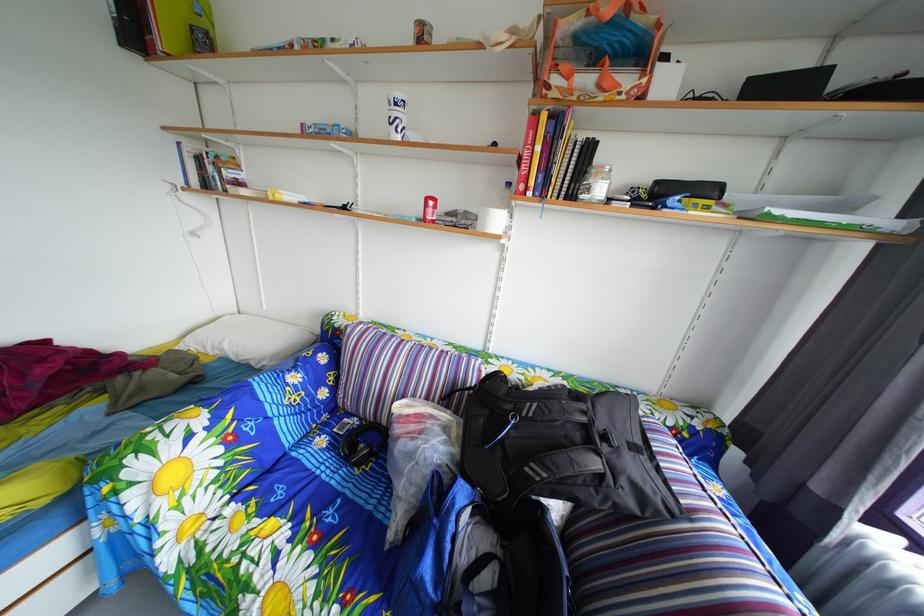
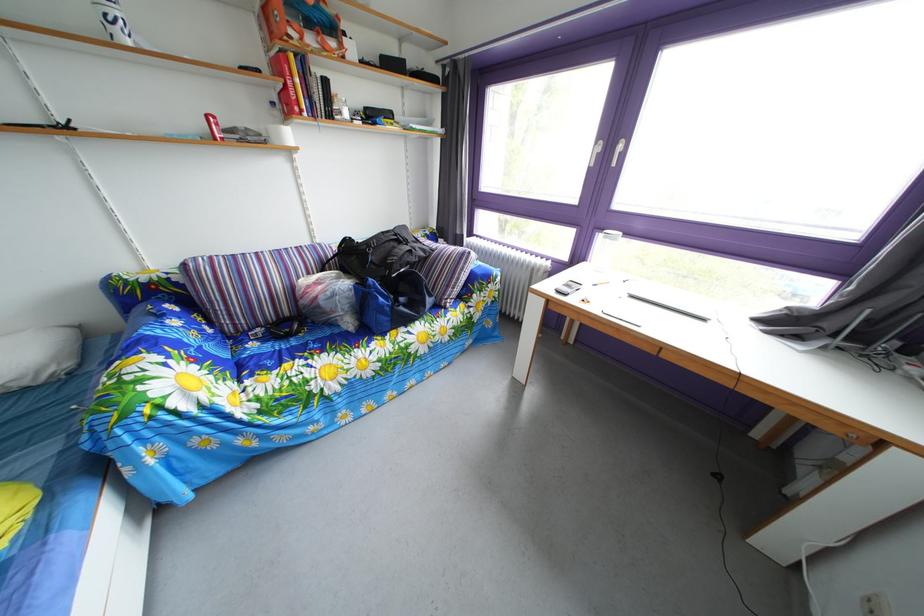
Locate, in the second image, the point that corresponds to the point at 611,485 in the first image.

(421, 260)